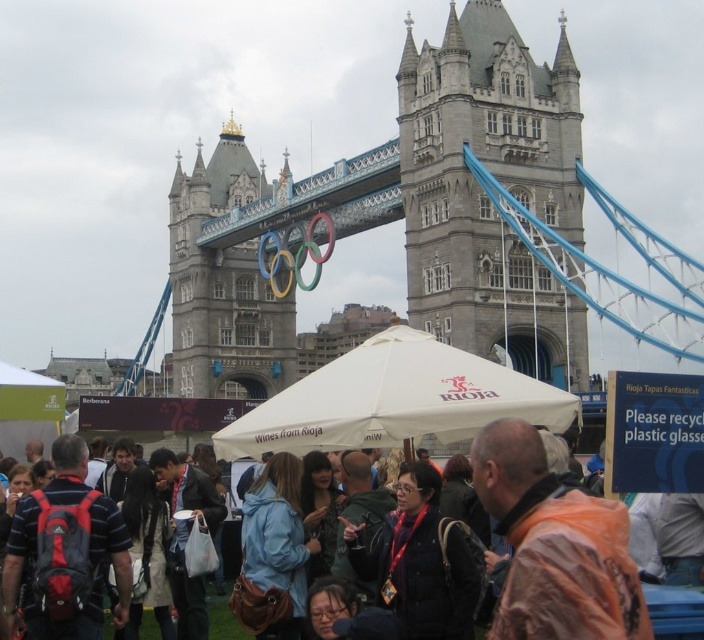
Measure the distance from white fabric canopy at center to stone gray tower at center.

white fabric canopy at center is 189.39 feet from stone gray tower at center.

Consider the image. Who is positioned more to the left, white fabric canopy at center or stone gray tower at center?

Positioned to the left is stone gray tower at center.

Which is in front, point (510, 394) or point (282, 323)?

Point (510, 394) is in front.

I want to click on white fabric canopy at center, so click(394, 400).

Between orange fabric jacket at lower right and striped fabric shirt at center, which one is positioned lower?

striped fabric shirt at center is lower down.

Can you confirm if orange fabric jacket at lower right is smaller than striped fabric shirt at center?

No, orange fabric jacket at lower right is not smaller than striped fabric shirt at center.

Where is `orange fabric jacket at lower right`? This screenshot has height=640, width=704. orange fabric jacket at lower right is located at coordinates (553, 547).

What are the coordinates of `orange fabric jacket at lower right` in the screenshot? It's located at (553, 547).

Identify the location of stone gray tower at center. coord(222,284).

Which is behind, point (234, 260) or point (84, 602)?

Point (234, 260)

Find the location of a particular element. This screenshot has height=640, width=704. stone gray tower at center is located at coordinates (222, 284).